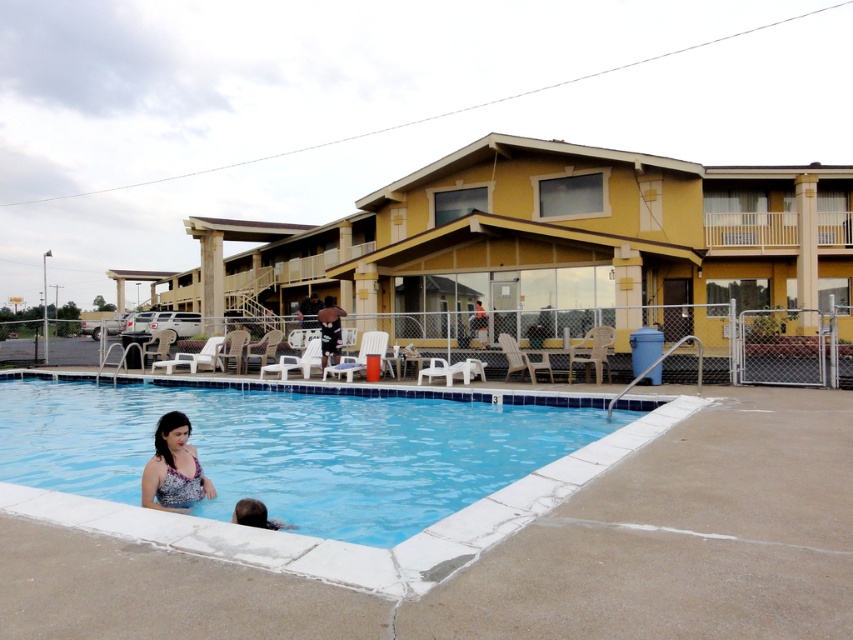
Identify the location of blue tile swimming pool at lower left. This screenshot has width=853, height=640. (291, 449).

Image resolution: width=853 pixels, height=640 pixels. Describe the element at coordinates (291, 449) in the screenshot. I see `blue tile swimming pool at lower left` at that location.

Is point (418, 506) positioned in front of point (194, 477)?

No.

Image resolution: width=853 pixels, height=640 pixels. What are the coordinates of `blue tile swimming pool at lower left` in the screenshot? It's located at (291, 449).

Does matte floral swimsuit at lower left appear on the right side of brown hair at lower left?

In fact, matte floral swimsuit at lower left is to the left of brown hair at lower left.

Can you confirm if matte floral swimsuit at lower left is positioned to the left of brown hair at lower left?

Correct, you'll find matte floral swimsuit at lower left to the left of brown hair at lower left.

The width and height of the screenshot is (853, 640). Describe the element at coordinates (173, 467) in the screenshot. I see `matte floral swimsuit at lower left` at that location.

I want to click on matte floral swimsuit at lower left, so click(x=173, y=467).

Between point (386, 534) and point (239, 516), which one is positioned in front?

Point (239, 516) is in front.

The image size is (853, 640). Describe the element at coordinates (291, 449) in the screenshot. I see `blue tile swimming pool at lower left` at that location.

Is point (535, 465) positioned after point (260, 513)?

Yes, it is behind point (260, 513).

Where is `blue tile swimming pool at lower left`? The height and width of the screenshot is (640, 853). blue tile swimming pool at lower left is located at coordinates (291, 449).